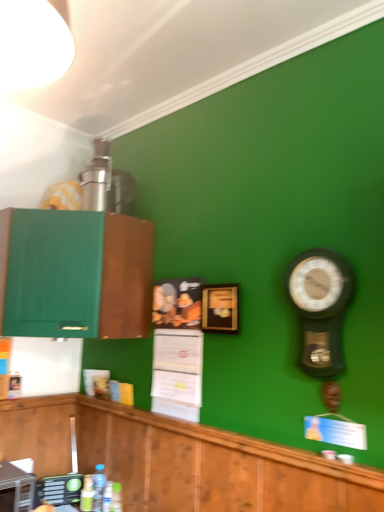
In order to face metallic silver toaster at lower left, which is counted as the second appliance, starting from the back, should I rotate leftwards or rightwards?

Rotate left and turn 24.139 degrees.

The image size is (384, 512). What do you see at coordinates (17, 487) in the screenshot? I see `metallic silver toaster at lower left, which is counted as the second appliance, starting from the back` at bounding box center [17, 487].

What is the approximate height of metallic pendulum clock at right?

metallic pendulum clock at right is 18.57 inches tall.

How much space does clear plastic bottle at lower center, which is the second bottle in left-to-right order, occupy horizontally?

clear plastic bottle at lower center, which is the second bottle in left-to-right order, is 3.01 inches wide.

The width and height of the screenshot is (384, 512). Describe the element at coordinates (60, 489) in the screenshot. I see `green plastic remote control at lower left, which ranks as the 2th appliance in front-to-back order` at that location.

How much space does translucent plastic bottle at lower center, positioned as the 2th bottle in right-to-left order, occupy horizontally?

translucent plastic bottle at lower center, positioned as the 2th bottle in right-to-left order, is 7.38 centimeters in width.

How much space does translucent plastic bottles at lower center, acting as the first bottle starting from the right, occupy horizontally?

2.75 inches.

Identify the location of wooden picture frame at center. coord(220,308).

From the image's perspective, between metallic silver toaster at lower left, which is counted as the second appliance, starting from the back, and wooden cabinetry at lower left, the 1th cabinetry from the bottom, who is located below?

metallic silver toaster at lower left, which is counted as the second appliance, starting from the back, appears lower in the image.

Considering the sizes of metallic silver toaster at lower left, positioned as the first appliance in front-to-back order, and wooden cabinetry at lower left, the 2th cabinetry positioned from the top, in the image, is metallic silver toaster at lower left, positioned as the first appliance in front-to-back order, wider or thinner than wooden cabinetry at lower left, the 2th cabinetry positioned from the top,?

Considering their sizes, metallic silver toaster at lower left, positioned as the first appliance in front-to-back order, looks broader than wooden cabinetry at lower left, the 2th cabinetry positioned from the top.

From a real-world perspective, does metallic silver toaster at lower left, positioned as the first appliance in front-to-back order, stand above wooden cabinetry at lower left, the 2th cabinetry positioned from the top?

No.

Does point (20, 486) come in front of point (39, 453)?

That is True.

What are the coordinates of `the 2nd cabinetry in front of the wooden picture frame at center` in the screenshot? It's located at (181, 460).

Considering the relative positions of wooden picture frame at center and wooden cabinetry at lower left, the 1th cabinetry from the bottom, in the image provided, is wooden picture frame at center to the right of wooden cabinetry at lower left, the 1th cabinetry from the bottom, from the viewer's perspective?

Yes.

Is point (210, 317) more distant than point (109, 415)?

That is False.

Does wooden picture frame at center touch wooden cabinetry at lower left, the 1th cabinetry from the bottom?

No.

What's the angular difference between translucent plastic bottle at lower center, positioned as the 2th bottle in right-to-left order, and metallic silver toaster at lower left, which is counted as the second appliance, starting from the back,'s facing directions?

The facing directions of translucent plastic bottle at lower center, positioned as the 2th bottle in right-to-left order, and metallic silver toaster at lower left, which is counted as the second appliance, starting from the back, are 88 degrees apart.

Looking at this image, is translucent plastic bottle at lower center, positioned as the 2th bottle in right-to-left order, aimed at metallic silver toaster at lower left, which is counted as the second appliance, starting from the back?

No, translucent plastic bottle at lower center, positioned as the 2th bottle in right-to-left order, does not turn towards metallic silver toaster at lower left, which is counted as the second appliance, starting from the back.

From a real-world perspective, which is physically above, translucent plastic bottle at lower center, the 3th bottle positioned from the left, or metallic silver toaster at lower left, which is counted as the second appliance, starting from the back?

metallic silver toaster at lower left, which is counted as the second appliance, starting from the back, from a real-world perspective.

Considering the points (108, 487) and (1, 473), which point is behind, point (108, 487) or point (1, 473)?

The point (108, 487) is behind.

Choose the correct answer: Is translucent plastic bottle at lower center, the 3th bottle positioned from the left, inside green plastic remote control at lower left, the 1th appliance from the back, or outside it?

translucent plastic bottle at lower center, the 3th bottle positioned from the left, is spatially situated outside green plastic remote control at lower left, the 1th appliance from the back.

What's the angular difference between translucent plastic bottle at lower center, positioned as the 2th bottle in right-to-left order, and green plastic remote control at lower left, which ranks as the 2th appliance in front-to-back order,'s facing directions?

64.8 degrees separate the facing orientations of translucent plastic bottle at lower center, positioned as the 2th bottle in right-to-left order, and green plastic remote control at lower left, which ranks as the 2th appliance in front-to-back order.

Considering the sizes of objects translucent plastic bottle at lower center, the 3th bottle positioned from the left, and green plastic remote control at lower left, the 1th appliance from the back, in the image provided, who is bigger, translucent plastic bottle at lower center, the 3th bottle positioned from the left, or green plastic remote control at lower left, the 1th appliance from the back,?

green plastic remote control at lower left, the 1th appliance from the back.

In the scene shown: How far apart are translucent plastic bottle at lower center, the 3th bottle positioned from the left, and green plastic remote control at lower left, which ranks as the 2th appliance in front-to-back order?

translucent plastic bottle at lower center, the 3th bottle positioned from the left, and green plastic remote control at lower left, which ranks as the 2th appliance in front-to-back order, are 10.45 inches apart.

Consider the image. From the image's perspective, between translucent plastic bottles at lower center, acting as the first bottle starting from the right, and green matte bottle at lower left, placed as the 1th bottle when sorted from left to right, which one is located above?

translucent plastic bottles at lower center, acting as the first bottle starting from the right, is shown above in the image.

How far apart are translucent plastic bottles at lower center, acting as the first bottle starting from the right, and green matte bottle at lower left, which ranks as the 4th bottle in right-to-left order?

A distance of 15.29 centimeters exists between translucent plastic bottles at lower center, acting as the first bottle starting from the right, and green matte bottle at lower left, which ranks as the 4th bottle in right-to-left order.

Looking at the image, does translucent plastic bottles at lower center, the 4th bottle when ordered from left to right, seem bigger or smaller compared to green matte bottle at lower left, which ranks as the 4th bottle in right-to-left order?

In the image, translucent plastic bottles at lower center, the 4th bottle when ordered from left to right, appears to be smaller than green matte bottle at lower left, which ranks as the 4th bottle in right-to-left order.

Is translucent plastic bottles at lower center, the 4th bottle when ordered from left to right, far from green matte bottle at lower left, placed as the 1th bottle when sorted from left to right?

Actually, translucent plastic bottles at lower center, the 4th bottle when ordered from left to right, and green matte bottle at lower left, placed as the 1th bottle when sorted from left to right, are a little close together.

Considering the points (52, 498) and (5, 494), which point is behind, point (52, 498) or point (5, 494)?

Point (52, 498)

Locate an element on the screen. appliance located below the metallic silver toaster at lower left, which is counted as the second appliance, starting from the back (from the image's perspective) is located at coordinates (60, 489).

Which of these two, wooden picture frame at center or metallic pendulum clock at right, is smaller?

With smaller size is wooden picture frame at center.

Which of these two, wooden picture frame at center or metallic pendulum clock at right, is wider?

Wider between the two is metallic pendulum clock at right.

Can you confirm if wooden picture frame at center is taller than metallic pendulum clock at right?

Incorrect, the height of wooden picture frame at center is not larger of that of metallic pendulum clock at right.

Considering the positions of objects wooden picture frame at center and metallic pendulum clock at right in the image provided, who is more to the right, wooden picture frame at center or metallic pendulum clock at right?

Positioned to the right is metallic pendulum clock at right.

From the metallic silver toaster at lower left, positioned as the first appliance in front-to-back order, count 2nd cabinetrys forward and point to it. Please provide its 2D coordinates.

[(181, 460)]

Identify the location of picture frame that appears above the wooden cabinetry at lower left, the 1th cabinetry from the bottom (from a real-world perspective). The height and width of the screenshot is (512, 384). (220, 308).

Considering their positions, is translucent plastic bottle at lower center, positioned as the 2th bottle in right-to-left order, positioned closer to wooden cabinetry at lower left, the 2th cabinetry positioned from the top, than clear plastic bottle at lower center, which is the second bottle in left-to-right order?

clear plastic bottle at lower center, which is the second bottle in left-to-right order, is positioned closer to the anchor wooden cabinetry at lower left, the 2th cabinetry positioned from the top.

Estimate the real-world distances between objects in this image. Which object is further from metallic pendulum clock at right, translucent plastic bottle at lower center, the 3th bottle positioned from the left, or translucent plastic bottles at lower center, the 4th bottle when ordered from left to right?

translucent plastic bottle at lower center, the 3th bottle positioned from the left, is positioned further to the anchor metallic pendulum clock at right.

Looking at the image, which one is located closer to green matte cabinet at left, which appears as the 2th cabinetry when ordered from the bottom, wooden picture frame at center or translucent plastic bottle at lower center, positioned as the 2th bottle in right-to-left order?

wooden picture frame at center is closer to green matte cabinet at left, which appears as the 2th cabinetry when ordered from the bottom.

From the image, which object appears to be nearer to clear plastic bottle at lower center, which is the second bottle in left-to-right order, translucent plastic bottles at lower center, acting as the first bottle starting from the right, or wooden picture frame at center?

translucent plastic bottles at lower center, acting as the first bottle starting from the right, is positioned closer to the anchor clear plastic bottle at lower center, which is the second bottle in left-to-right order.

Considering their positions, is wooden picture frame at center positioned further to clear plastic bottle at lower center, which is the second bottle in left-to-right order, than metallic silver toaster at lower left, positioned as the first appliance in front-to-back order?

wooden picture frame at center lies further to clear plastic bottle at lower center, which is the second bottle in left-to-right order, than the other object.

Which object lies further to the anchor point green plastic remote control at lower left, which ranks as the 2th appliance in front-to-back order, green matte cabinet at left, which appears as the 2th cabinetry when ordered from the bottom, or wooden cabinetry at lower left, the 1th cabinetry from the bottom?

green matte cabinet at left, which appears as the 2th cabinetry when ordered from the bottom.

From the image, which object appears to be nearer to clear plastic bottle at lower center, which is the second bottle in left-to-right order, green matte bottle at lower left, placed as the 1th bottle when sorted from left to right, or wooden picture frame at center?

green matte bottle at lower left, placed as the 1th bottle when sorted from left to right, is closer to clear plastic bottle at lower center, which is the second bottle in left-to-right order.

Based on the photo, estimate the real-world distances between objects in this image. Which object is closer to green plastic remote control at lower left, the 1th appliance from the back, metallic pendulum clock at right or wooden picture frame at center?

wooden picture frame at center is closer to green plastic remote control at lower left, the 1th appliance from the back.

Locate an element on the screen. This screenshot has height=512, width=384. picture frame between metallic pendulum clock at right and green matte bottle at lower left, placed as the 1th bottle when sorted from left to right, in the up-down direction is located at coordinates (220, 308).

The height and width of the screenshot is (512, 384). I want to click on picture frame that lies between green matte cabinet at left, marked as the 1th cabinetry in a top-to-bottom arrangement, and metallic silver toaster at lower left, positioned as the first appliance in front-to-back order, from top to bottom, so click(x=220, y=308).

Locate an element on the screen. cabinetry between wooden picture frame at center and translucent plastic bottle at lower center, the 3th bottle positioned from the left, vertically is located at coordinates (181, 460).

Find the location of a particular element. This screenshot has width=384, height=512. cabinetry that lies between metallic pendulum clock at right and translucent plastic bottle at lower center, positioned as the 2th bottle in right-to-left order, from top to bottom is located at coordinates click(181, 460).